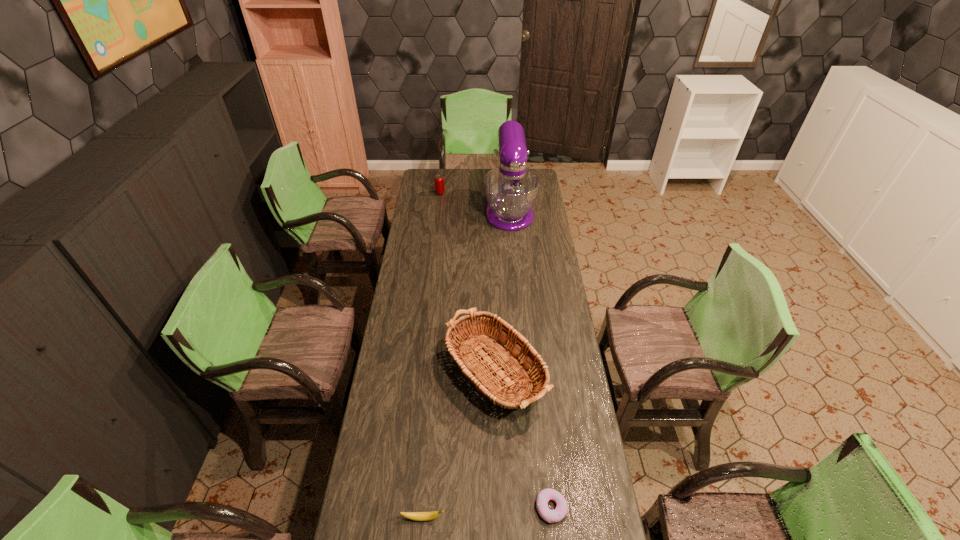
Where is `vacant space located 0.250m on the left of the doughnut`? The width and height of the screenshot is (960, 540). vacant space located 0.250m on the left of the doughnut is located at coordinates (453, 508).

Find the location of a particular element. The image size is (960, 540). object located at the far edge is located at coordinates (511, 190).

Find the location of a particular element. The height and width of the screenshot is (540, 960). basket situated at the left edge is located at coordinates (502, 346).

Image resolution: width=960 pixels, height=540 pixels. I want to click on can situated at the left edge, so click(x=439, y=179).

At what (x,y) coordinates should I click in order to perform the action: click on banana situated at the left edge. Please return your answer as a coordinate pair (x, y). Looking at the image, I should click on (417, 516).

Where is `mixer positioned at the right edge`? The width and height of the screenshot is (960, 540). mixer positioned at the right edge is located at coordinates (511, 190).

The image size is (960, 540). In order to click on basket that is at the right edge in this screenshot , I will do `click(502, 346)`.

The image size is (960, 540). Identify the location of doughnut that is at the right edge. (551, 516).

The width and height of the screenshot is (960, 540). Find the location of `object present at the far right corner`. object present at the far right corner is located at coordinates (511, 190).

Identify the location of free space at the left edge of the desktop. (420, 389).